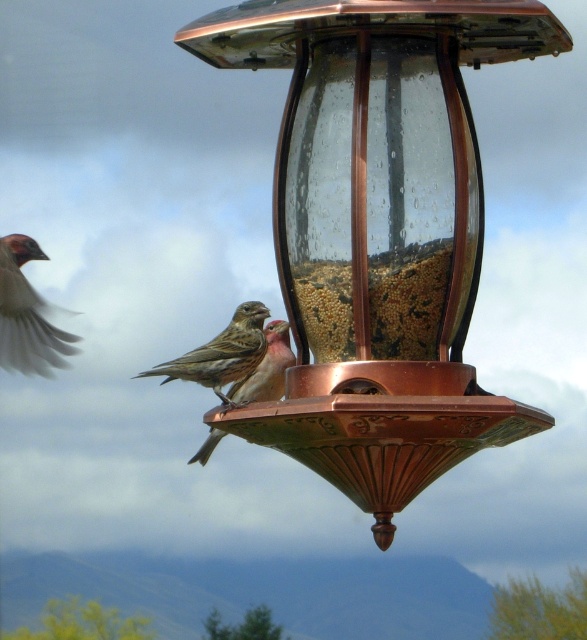
You are a birdwatcher observing the scene. You notice the copper glass bird feeder at center and the white matte sparrow at left. Which object is bigger in size?

The copper glass bird feeder at center is larger in size than the white matte sparrow at left.

You are a birdwatcher standing at the base of the tree where the copper glass bird feeder at center and the brown speckled sparrow at center are located. You want to take a photo that captures both birds clearly in the same frame. Given the distance between them, will you need to adjust your camera lens to a wider angle to ensure both are visible?

The copper glass bird feeder at center is 22.09 meters away from the brown speckled sparrow at center. Since the distance between them is significant, you would need to adjust your camera lens to a wider angle to ensure both the copper glass bird feeder at center and the brown speckled sparrow at center are visible in the same frame.